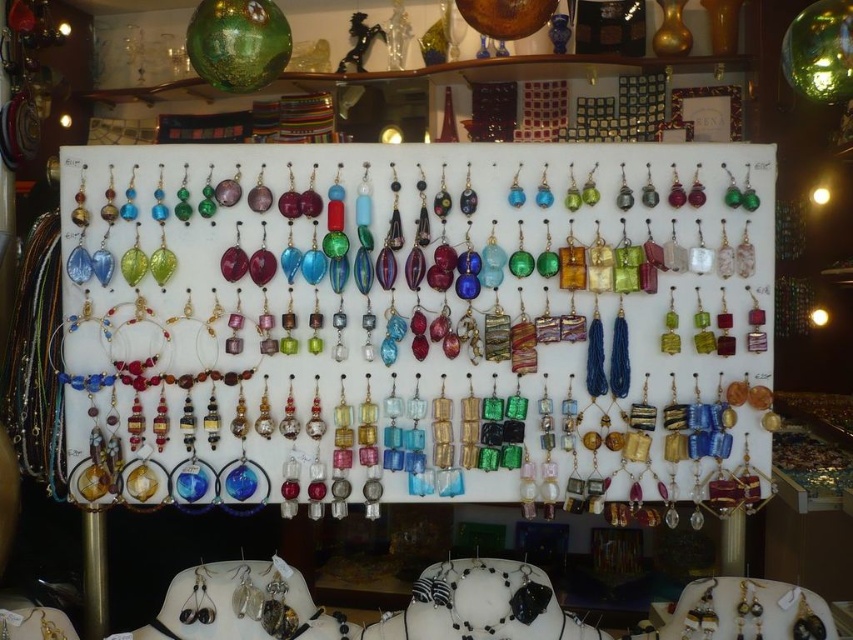
Can you confirm if translucent glass earrings at center is wider than gold metallic necklace at lower left?

Yes, translucent glass earrings at center is wider than gold metallic necklace at lower left.

From the picture: Between translucent glass earrings at center and gold metallic necklace at lower left, which one has less height?

With less height is gold metallic necklace at lower left.

This screenshot has height=640, width=853. What are the coordinates of `translucent glass earrings at center` in the screenshot? It's located at tap(418, 326).